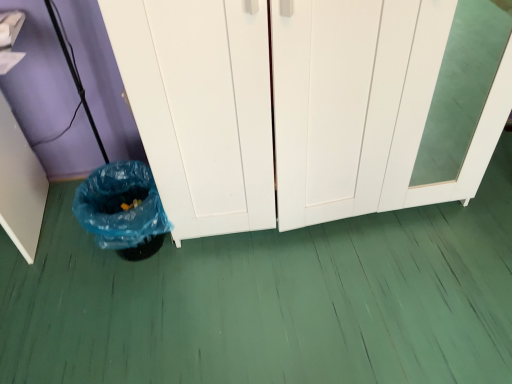
Where is `vacant space to the left of blue plastic bag at lower left`? vacant space to the left of blue plastic bag at lower left is located at coordinates (63, 259).